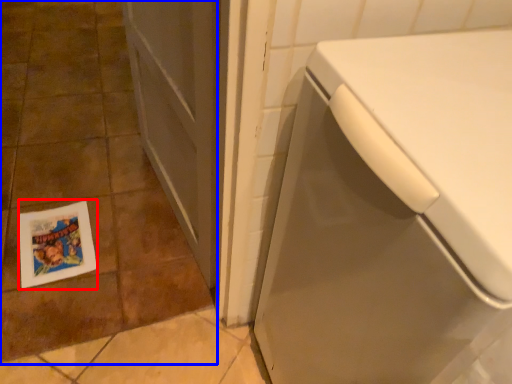
Question: Which object appears farthest to the camera in this image, flyer (highlighted by a red box) or ceramic tile (highlighted by a blue box)?

Choices:
 (A) flyer
 (B) ceramic tile

Answer: (A)